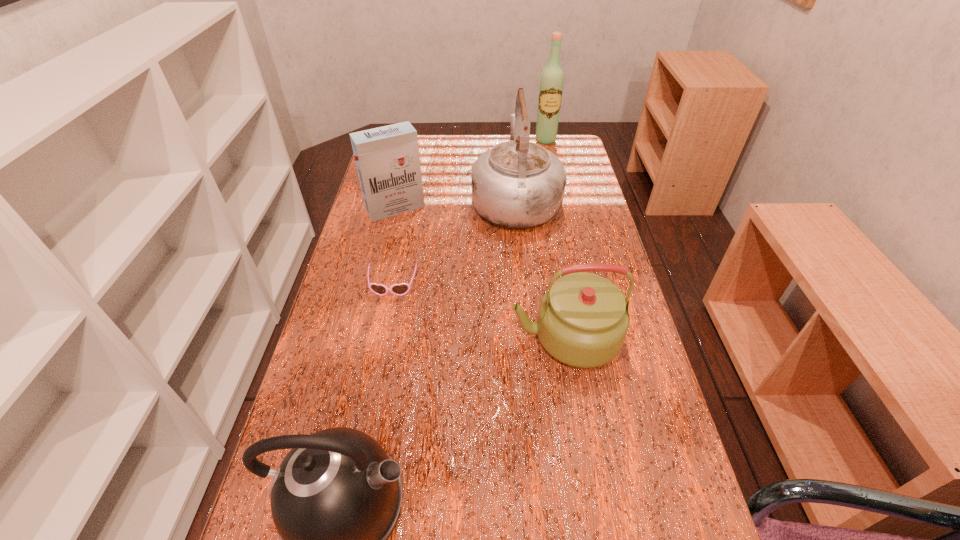
Where is `free space at the far edge of the desktop`? This screenshot has width=960, height=540. free space at the far edge of the desktop is located at coordinates (473, 143).

Find the location of a particular element. free space at the left edge of the desktop is located at coordinates (362, 245).

Locate an element on the screen. This screenshot has width=960, height=540. free space at the right edge of the desktop is located at coordinates (647, 359).

Locate an element on the screen. free spot between the cigarette case and the wine bottle is located at coordinates (470, 174).

Identify the location of free area in between the fifth farthest object and the shortest object. The height and width of the screenshot is (540, 960). (479, 312).

Locate an element on the screen. This screenshot has width=960, height=540. vacant area that lies between the farthest kettle and the sunglasses is located at coordinates (454, 244).

Where is `vacant region between the cigarette case and the second nearest kettle`? This screenshot has width=960, height=540. vacant region between the cigarette case and the second nearest kettle is located at coordinates (480, 273).

Locate an element on the screen. This screenshot has height=540, width=960. vacant region between the cigarette case and the farthest object is located at coordinates (470, 174).

Locate an element on the screen. empty space that is in between the farthest object and the fourth farthest object is located at coordinates (469, 213).

Find the location of a particular element. free space between the farthest kettle and the second nearest object is located at coordinates (540, 268).